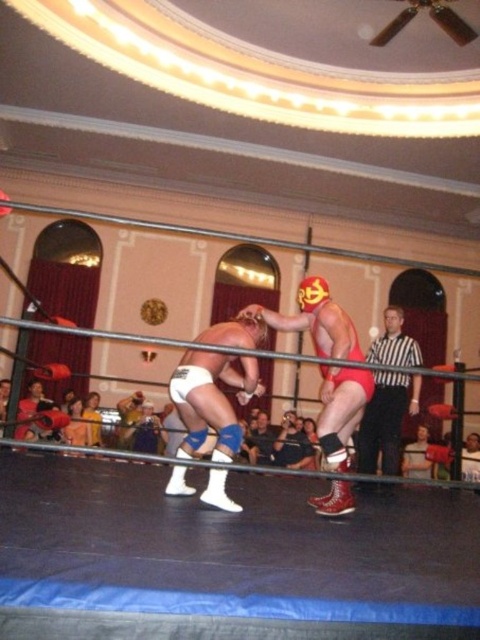
Question: Is white matte shorts at center behind red matte wrestling mask at center?

Choices:
 (A) yes
 (B) no

Answer: (B)

Question: Can you confirm if red matte wrestling mask at center is thinner than black-and-white striped shirt at right?

Choices:
 (A) yes
 (B) no

Answer: (B)

Question: Is white matte shorts at center above black-and-white striped shirt at right?

Choices:
 (A) no
 (B) yes

Answer: (B)

Question: Which object appears closest to the camera in this image?

Choices:
 (A) red matte wrestling mask at center
 (B) black-and-white striped shirt at right

Answer: (A)

Question: Based on their relative distances, which object is nearer to the white matte shorts at center?

Choices:
 (A) red matte wrestling mask at center
 (B) black-and-white striped shirt at right

Answer: (A)

Question: Which point is farther to the camera?

Choices:
 (A) (369, 400)
 (B) (382, 472)

Answer: (B)